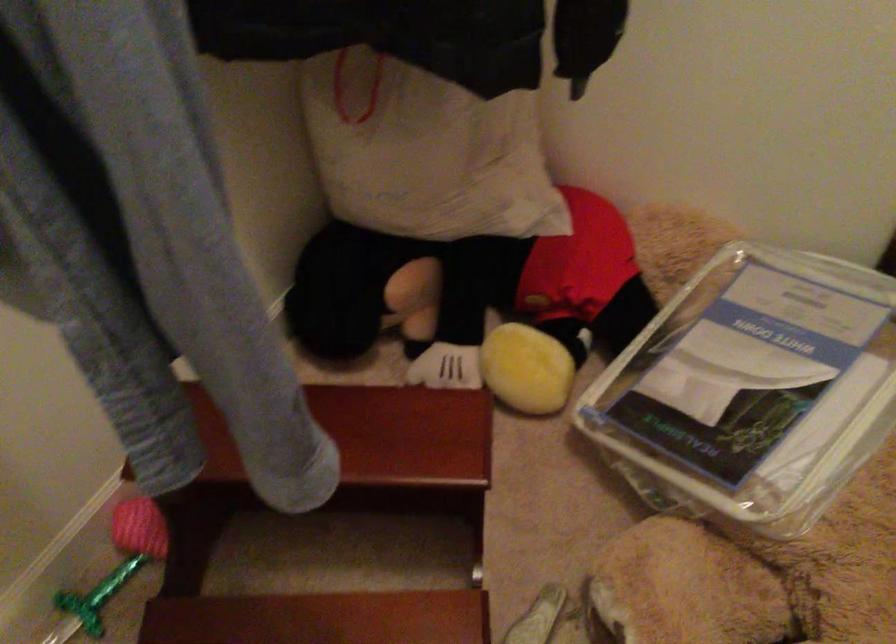
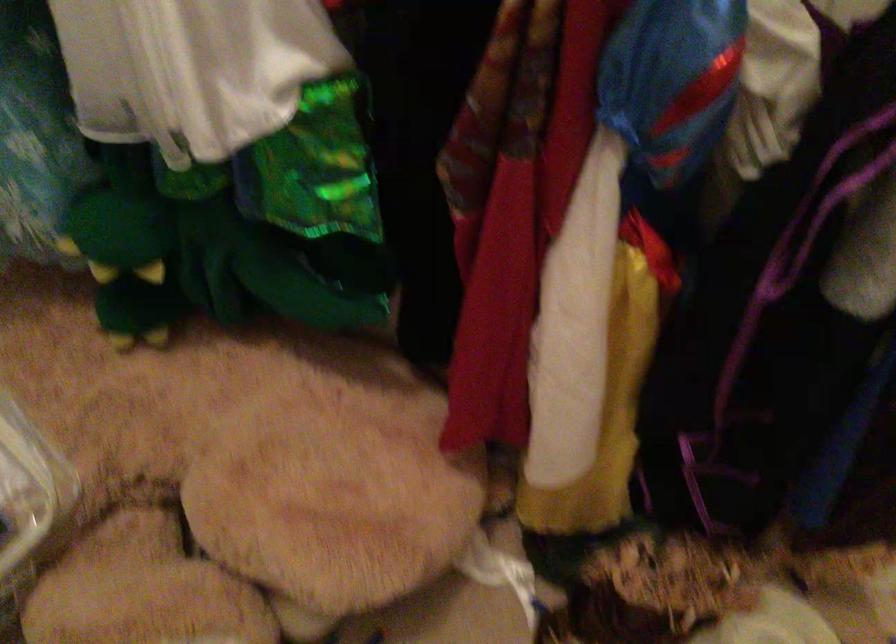
The first image is from the beginning of the video and the second image is from the end. How did the camera likely rotate when shooting the video?

The camera rotated toward right-down.